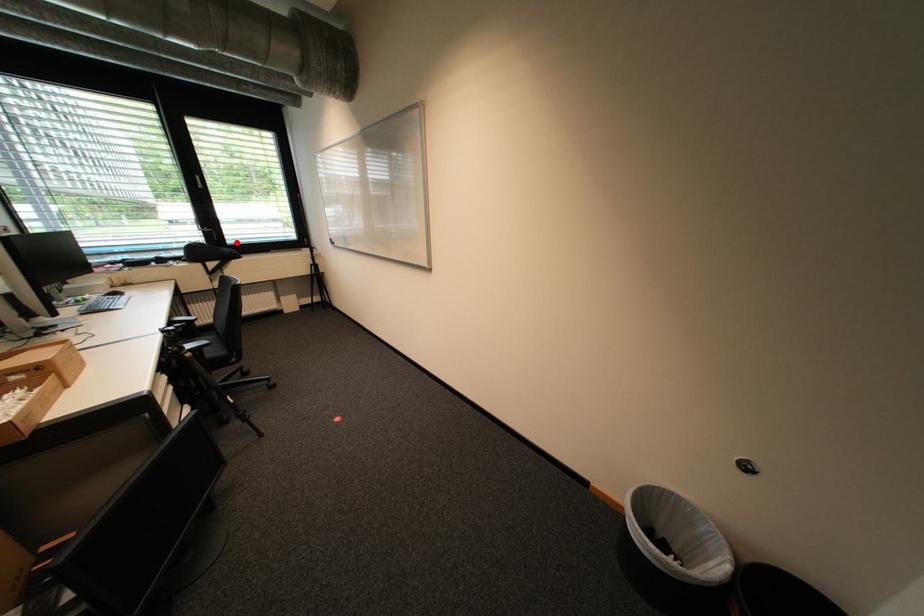
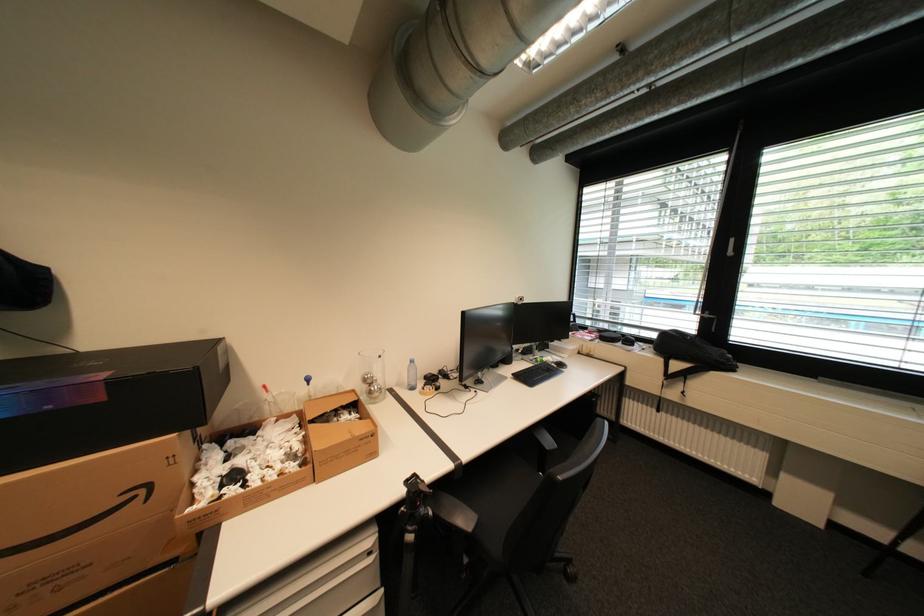
The point at the highlighted location is marked in the first image. Where is the corresponding point in the second image?

(739, 339)